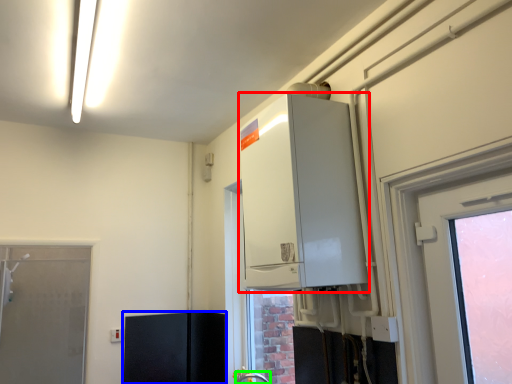
Question: Considering the real-world distances, which object is closest to appliance (highlighted by a red box)? cabinetry (highlighted by a blue box) or faucet (highlighted by a green box).

Choices:
 (A) cabinetry
 (B) faucet

Answer: (B)